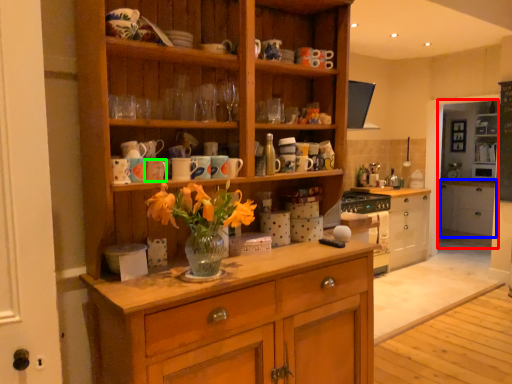
Question: Based on their relative distances, which object is farther from shelf (highlighted by a red box)? Choose from cabinetry (highlighted by a blue box) and mug (highlighted by a green box).

Choices:
 (A) cabinetry
 (B) mug

Answer: (B)